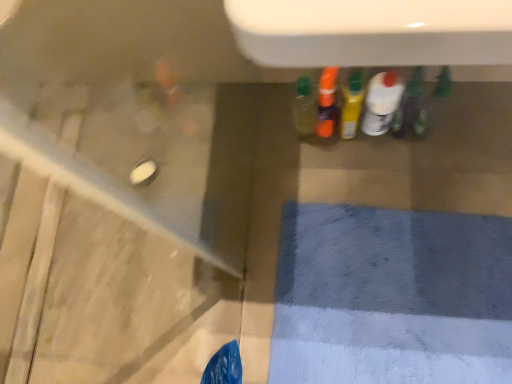
Question: Considering the positions of white glossy bottle at center, the fourth bottle positioned from the left, and green matte bottle at center, marked as the 1th bottle in a right-to-left arrangement, in the image, is white glossy bottle at center, the fourth bottle positioned from the left, taller or shorter than green matte bottle at center, marked as the 1th bottle in a right-to-left arrangement,?

Choices:
 (A) tall
 (B) short

Answer: (B)

Question: Is white glossy bottle at center, the second bottle positioned from the right, wider or thinner than green matte bottle at center, marked as the 1th bottle in a right-to-left arrangement?

Choices:
 (A) wide
 (B) thin

Answer: (B)

Question: Estimate the real-world distances between objects in this image. Which object is closer to the green matte bottle at center, which ranks as the 5th bottle in left-to-right order?

Choices:
 (A) translucent orange bottle at center, the 2th bottle when ordered from left to right
 (B) white glossy bottle at center, the second bottle positioned from the right
 (C) translucent plastic bottle at center, arranged as the third bottle when viewed from the right
 (D) translucent plastic bottle at center, placed as the first bottle when sorted from left to right

Answer: (B)

Question: Which is nearer to the translucent orange bottle at center, the fourth bottle positioned from the right?

Choices:
 (A) white glossy bottle at center, the second bottle positioned from the right
 (B) translucent plastic bottle at center, placed as the first bottle when sorted from left to right
 (C) green matte bottle at center, marked as the 1th bottle in a right-to-left arrangement
 (D) translucent plastic bottle at center, arranged as the third bottle when viewed from the right

Answer: (D)